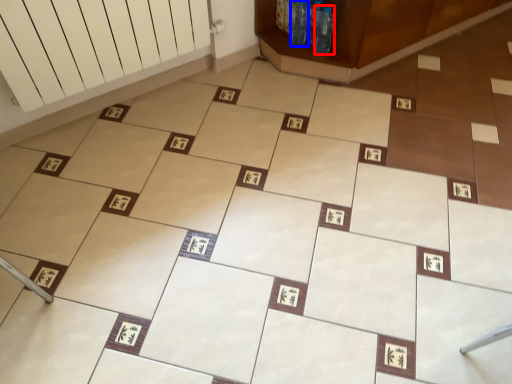
Question: Among these objects, which one is nearest to the camera, bottle (highlighted by a red box) or bottle (highlighted by a blue box)?

Choices:
 (A) bottle
 (B) bottle

Answer: (A)